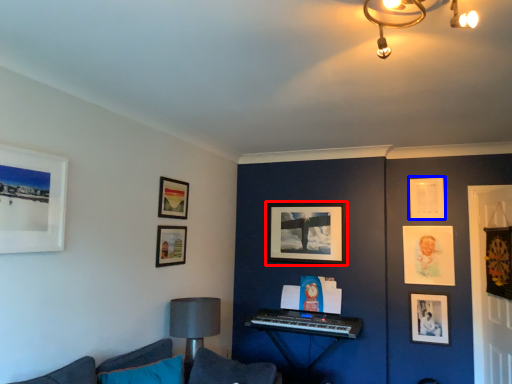
Question: Which object appears farthest to the camera in this image, picture frame (highlighted by a red box) or picture frame (highlighted by a blue box)?

Choices:
 (A) picture frame
 (B) picture frame

Answer: (A)